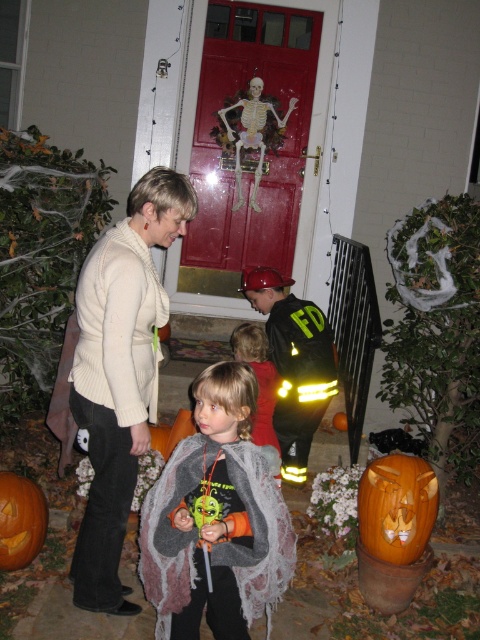
How far apart are white sweater at center and orange carved pumpkin at lower left?

A distance of 23.96 inches exists between white sweater at center and orange carved pumpkin at lower left.

Is point (105, 595) in front of point (11, 500)?

Yes, it is.

The width and height of the screenshot is (480, 640). I want to click on white sweater at center, so click(120, 372).

Does reflective black fireman suit at center have a smaller size compared to gray wool cape at center?

No, reflective black fireman suit at center is not smaller than gray wool cape at center.

Is reflective black fireman suit at center positioned before gray wool cape at center?

That is False.

In order to click on reflective black fireman suit at center in this screenshot , I will do `click(294, 364)`.

Does orange carved pumpkin at lower left have a smaller size compared to gray wool cape at center?

Yes.

Is point (24, 502) positioned in front of point (244, 326)?

Yes.

Is point (22, 492) in front of point (256, 444)?

Yes, point (22, 492) is closer to viewer.

Locate an element on the screen. orange carved pumpkin at lower left is located at coordinates (21, 520).